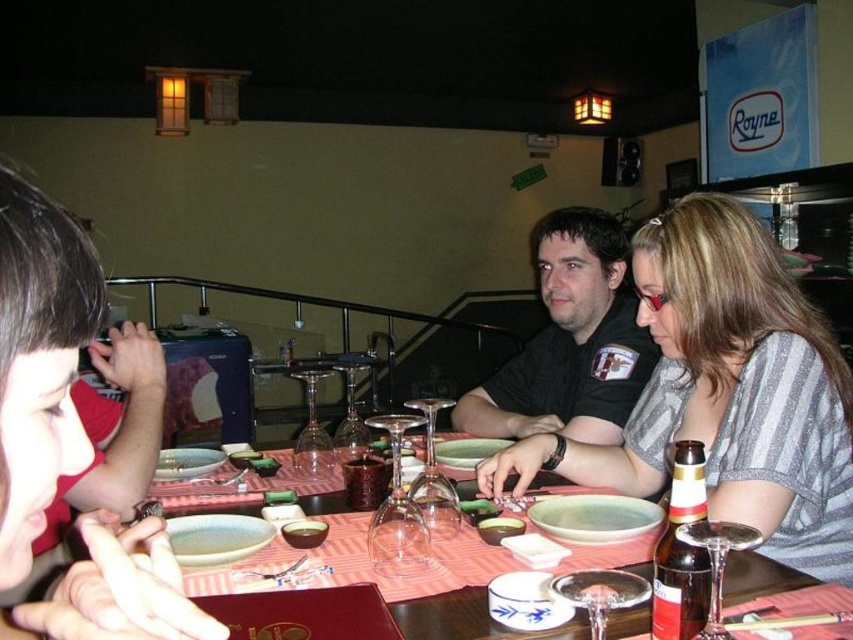
You are a server at the restaurant and need to place a new menu on the table. The menu is 15 cm wide. There is a black matte shirt at center and a matte ceramic bowl at center on the table. Can you fit the menu between them?

The black matte shirt at center is positioned on the right side of matte ceramic bowl at center. Since the menu is 15 cm wide, you need to check the distance between them. However, the description does not provide the exact distance between the two objects, so it is uncertain if there is enough space to fit the menu between them.

You are a server at the restaurant and need to place a new drink order on the table. The table has a black matte shirt at center and a smooth ceramic bowl at center. Which item should you avoid placing the drink next to to prevent it from tipping over?

You should avoid placing the drink next to the black matte shirt at center because it is larger in size than the smooth ceramic bowl at center, making it more likely to cause instability if the drink is placed nearby.

You are a server who just arrived at the table. You need to deliver a dessert plate that is 10 inches in diameter. Can you place it between the striped fabric shirt at center and the smooth porcelain bowl at center without moving any existing items?

The distance between the striped fabric shirt at center and the smooth porcelain bowl at center is 9.39 inches. Since the dessert plate is 10 inches in diameter, it would not fit in the space between them without moving existing items.